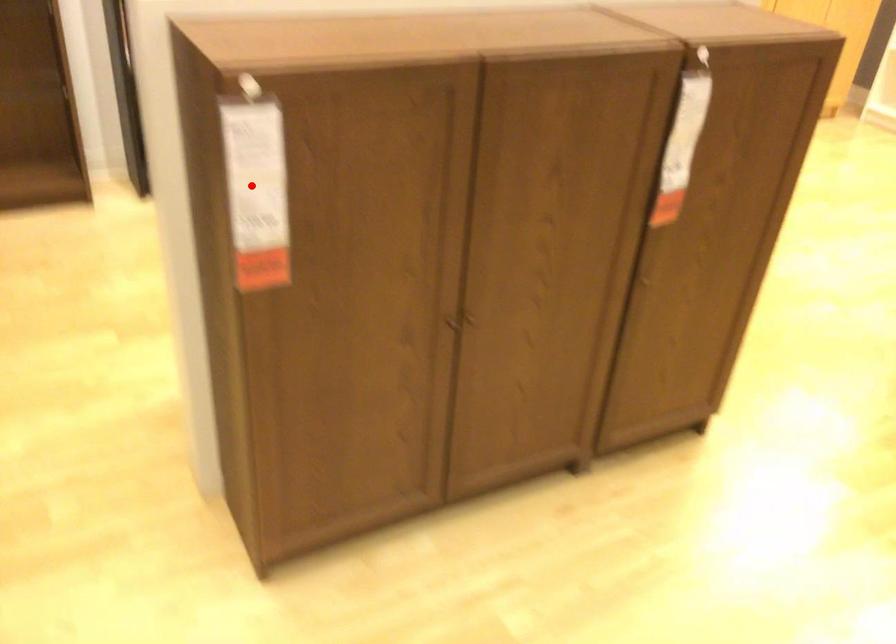
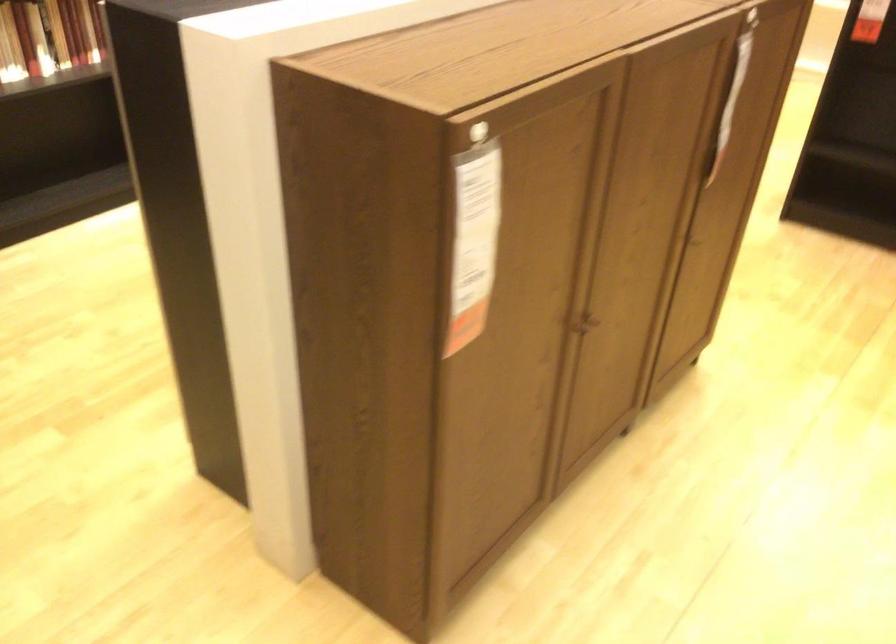
In the second image, find the point that corresponds to the highlighted location in the first image.

(474, 242)